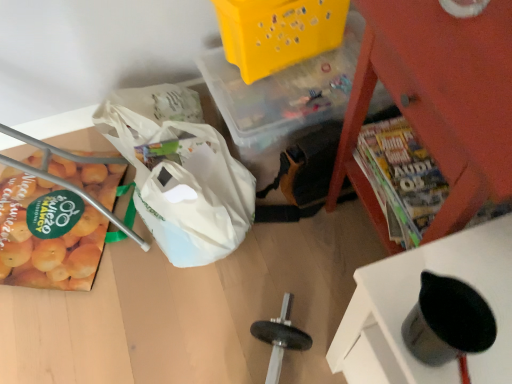
Find the location of a particular element. free location in front of white plastic grocery bag at lower left is located at coordinates (163, 332).